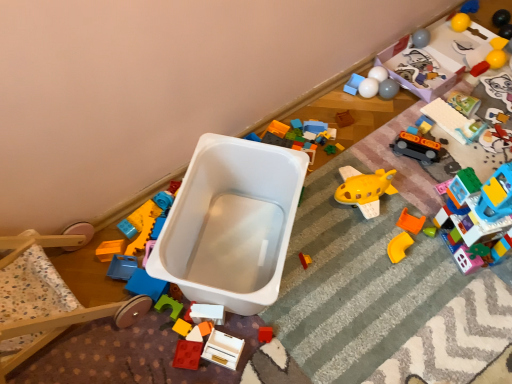
Find the location of a particular element. This screenshot has height=384, width=512. free space between white plastic baby carriage at center and translucent plastic building blocks at right, arranged as the 5th toy when viewed from the right is located at coordinates (362, 258).